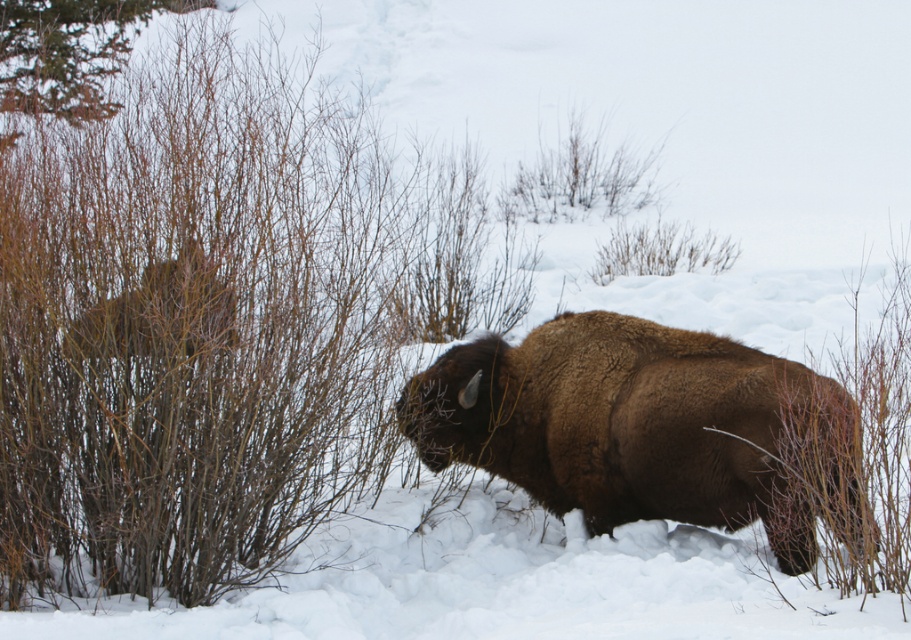
You are standing in the winter scene and want to know how far the point at coordinates (303, 138) is from you. Can you determine the distance?

The point at coordinates (303, 138) is 11.52 meters away from the viewer.

You are a wildlife photographer aiming to capture the bison in the center of your photo. However, there is a brown woody bush at left in the frame. Where should you position the bush relative to the bison to ensure it doesn not obstruct the bison?

The brown woody bush at left is located at coordinates point (193,324), so positioning it to the left side of the bison will keep it out of the way without obstructing the main subject.